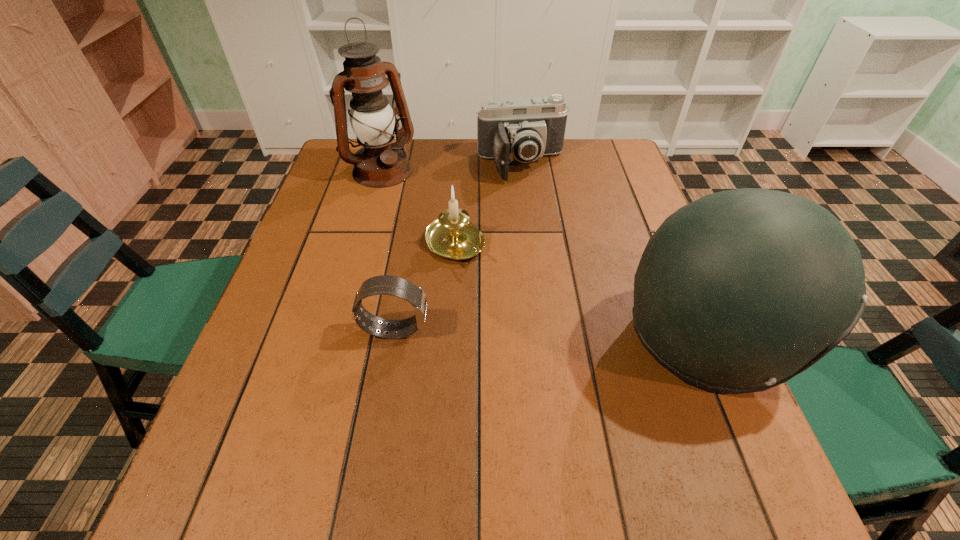
Where is `free location that satisfies the following two spatial constraints: 1. on the back side of the candle holder; 2. on the right side of the camera`? free location that satisfies the following two spatial constraints: 1. on the back side of the candle holder; 2. on the right side of the camera is located at coordinates (460, 165).

Find the location of a particular element. This screenshot has height=540, width=960. vacant space that satisfies the following two spatial constraints: 1. on the front side of the shortest object; 2. on the face of the lantern is located at coordinates (336, 329).

The height and width of the screenshot is (540, 960). In order to click on vacant space that satisfies the following two spatial constraints: 1. on the front side of the shortest object; 2. on the face of the lantern in this screenshot , I will do `click(336, 329)`.

What are the coordinates of `free spot that satisfies the following two spatial constraints: 1. on the front side of the lantern; 2. at the face opening of the rightmost object` in the screenshot? It's located at (333, 340).